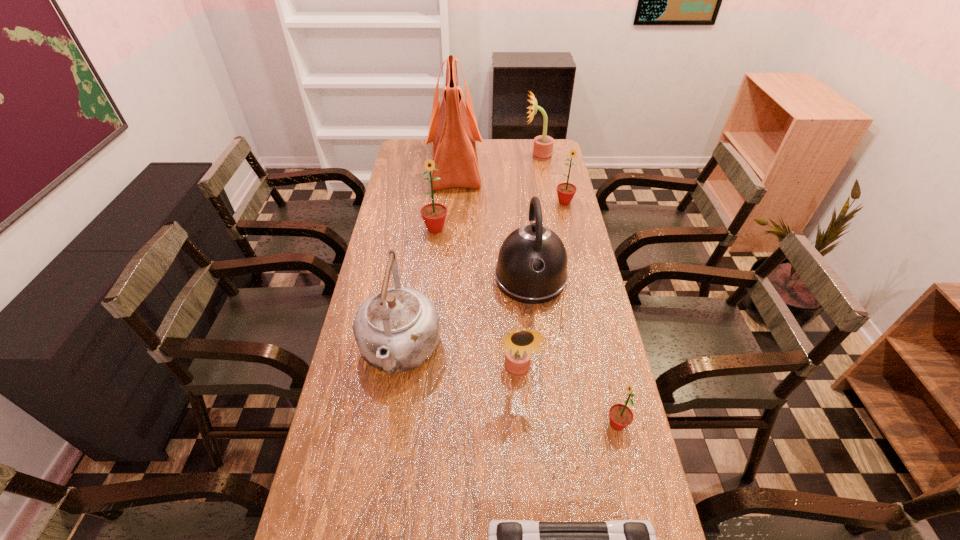
Select which yellow sunflower is the second closest to the tallest object. Please provide its 2D coordinates. Your answer should be formatted as a tuple, i.e. [(x, y)], where the tuple contains the x and y coordinates of a point satisfying the conditions above.

[(519, 344)]

This screenshot has height=540, width=960. In order to click on yellow sunflower that stands as the second closest to the right kettle in this screenshot , I will do `click(543, 145)`.

Where is `green sunflower that is the third closest to the first-aid kit`? Image resolution: width=960 pixels, height=540 pixels. green sunflower that is the third closest to the first-aid kit is located at coordinates (566, 191).

The image size is (960, 540). Identify the location of green sunflower that is the third closest to the smaller yellow sunflower. (566, 191).

In order to click on vacant position in the image that satisfies the following two spatial constraints: 1. on the face of the bigger yellow sunflower; 2. at the spout of the nearer kettle in this screenshot , I will do `click(573, 352)`.

What are the coordinates of `free space that satisfies the following two spatial constraints: 1. on the face of the farther yellow sunflower; 2. on the face of the second nearest sunflower` in the screenshot? It's located at (577, 371).